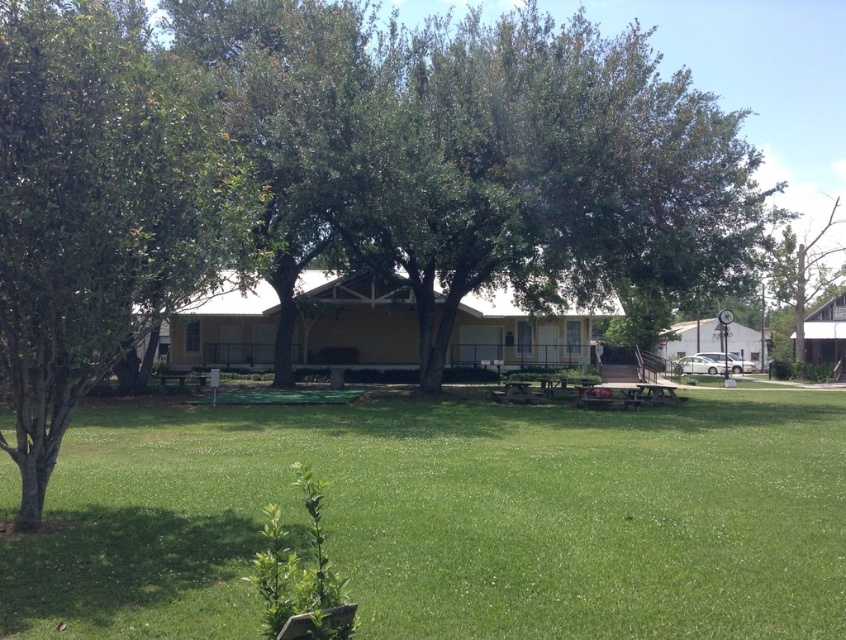
Question: Is green grass at center positioned before green leafy tree at left?

Choices:
 (A) no
 (B) yes

Answer: (B)

Question: Among these objects, which one is nearest to the camera?

Choices:
 (A) green grass at center
 (B) green leafy tree at left

Answer: (A)

Question: Is green grass at center closer to the viewer compared to green leafy tree at left?

Choices:
 (A) yes
 (B) no

Answer: (A)

Question: Does green grass at center appear under green leafy tree at left?

Choices:
 (A) no
 (B) yes

Answer: (B)